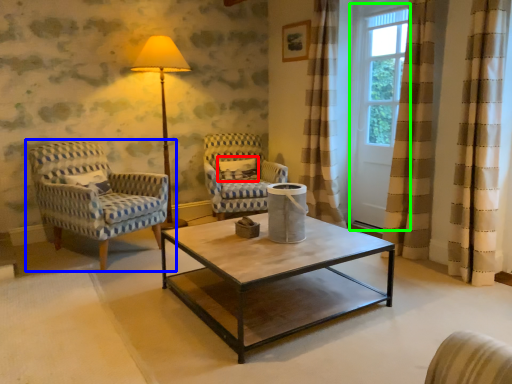
Question: Which object is the farthest from pillow (highlighted by a red box)? Choose among these: chair (highlighted by a blue box) or screen door (highlighted by a green box).

Choices:
 (A) chair
 (B) screen door

Answer: (B)